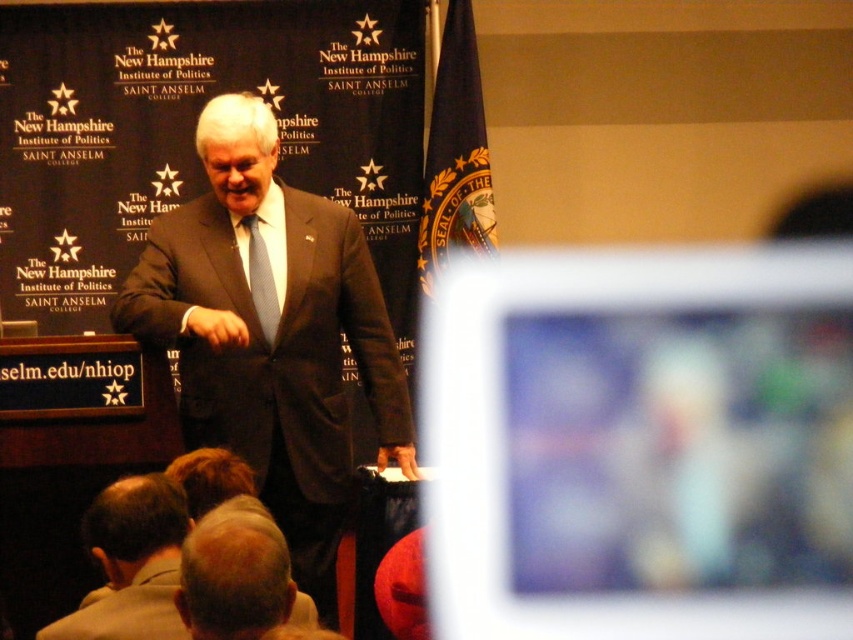
Question: Which object appears farthest from the camera in this image?

Choices:
 (A) light blue textured tie at center
 (B) light brown hair at lower left

Answer: (A)

Question: Is dark brown suit at center wider than light blue textured tie at center?

Choices:
 (A) yes
 (B) no

Answer: (A)

Question: Estimate the real-world distances between objects in this image. Which object is farther from the light blue textured tie at center?

Choices:
 (A) light brown hair at lower left
 (B) dark brown suit at center

Answer: (A)

Question: Among these objects, which one is nearest to the camera?

Choices:
 (A) light brown hair at lower left
 (B) light blue textured tie at center
 (C) dark brown suit at center

Answer: (A)

Question: Can you confirm if dark brown suit at center is thinner than light brown hair at lower center?

Choices:
 (A) no
 (B) yes

Answer: (A)

Question: Does dark brown suit at center appear over light brown hair at lower left?

Choices:
 (A) yes
 (B) no

Answer: (A)